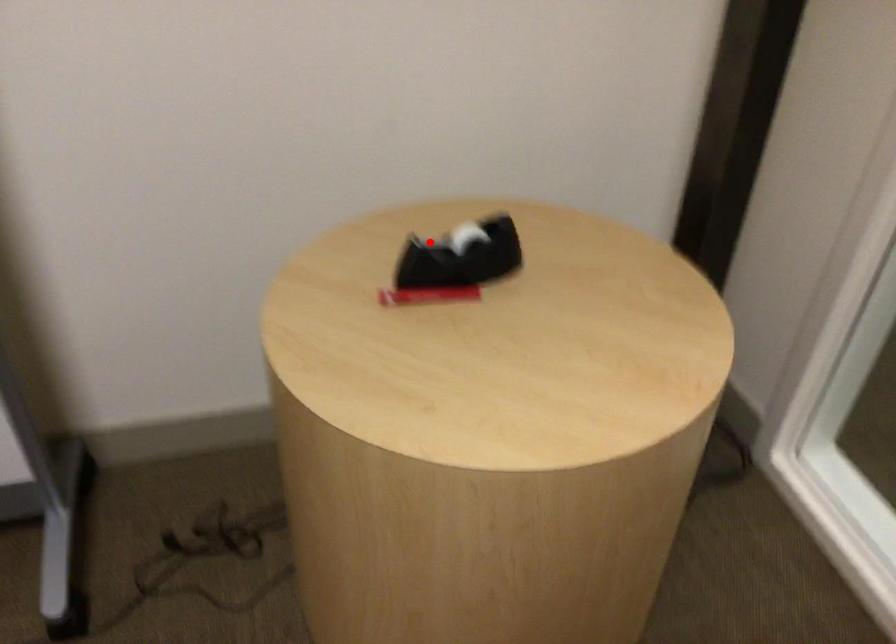
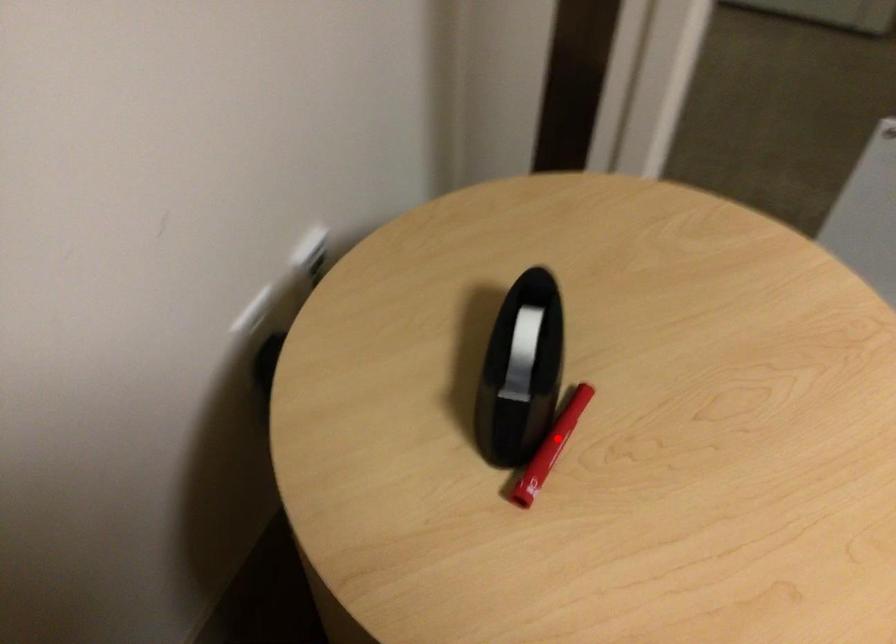
I am providing you with two images of the same scene from different viewpoints. A red point is marked on the first image and another point is marked on the second image. Is the red point in image1 aligned with the point shown in image2?

No